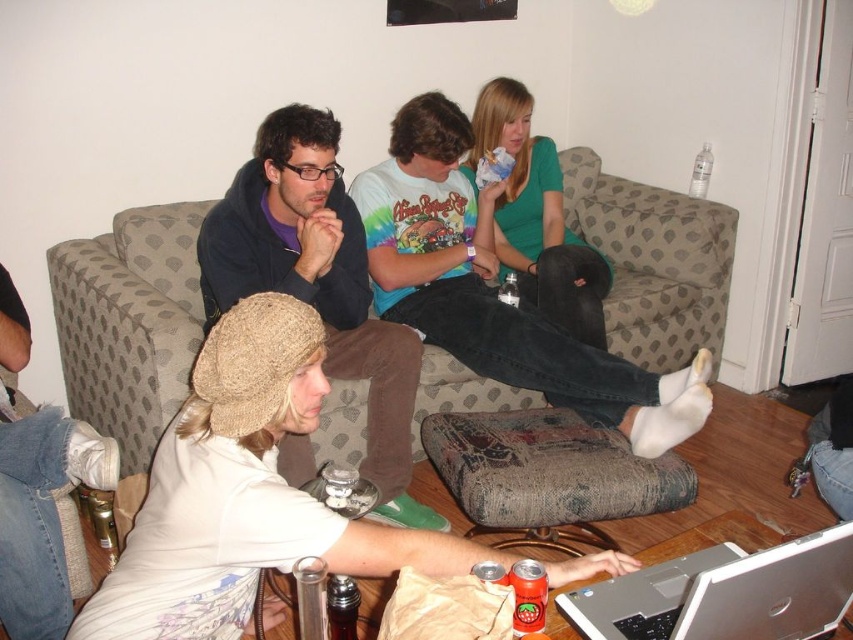
Does white knit hat at center lie behind silver metallic laptop at lower right?

That is True.

Consider the image. Does white knit hat at center appear on the left side of silver metallic laptop at lower right?

Yes, white knit hat at center is to the left of silver metallic laptop at lower right.

What are the coordinates of `white knit hat at center` in the screenshot? It's located at click(244, 492).

Can you confirm if white knit hat at center is positioned below green matte shirt at upper center?

Result: Indeed, white knit hat at center is positioned under green matte shirt at upper center.

In the scene shown: Is white knit hat at center bigger than green matte shirt at upper center?

Result: No.

Find the location of a particular element. The width and height of the screenshot is (853, 640). white knit hat at center is located at coordinates (244, 492).

Locate an element on the screen. white knit hat at center is located at coordinates (244, 492).

Does point (372, 410) come closer to viewer compared to point (503, 204)?

That is True.

Does matte black hoodie at center appear on the left side of green matte shirt at upper center?

Yes, matte black hoodie at center is to the left of green matte shirt at upper center.

You are a GUI agent. You are given a task and a screenshot of the screen. Output one action in this format:
    pyautogui.click(x=<x>, y=<y>)
    Task: Click on the matte black hoodie at center
    This screenshot has height=640, width=853.
    Given the screenshot: What is the action you would take?
    pyautogui.click(x=318, y=282)